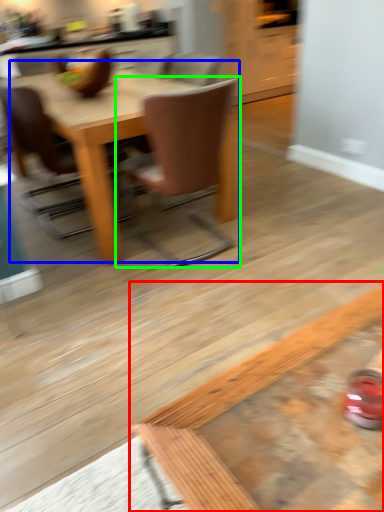
Question: Which object is the farthest from coffee table (highlighted by a red box)? Choose among these: kitchen & dining room table (highlighted by a blue box) or chair (highlighted by a green box).

Choices:
 (A) kitchen & dining room table
 (B) chair

Answer: (A)